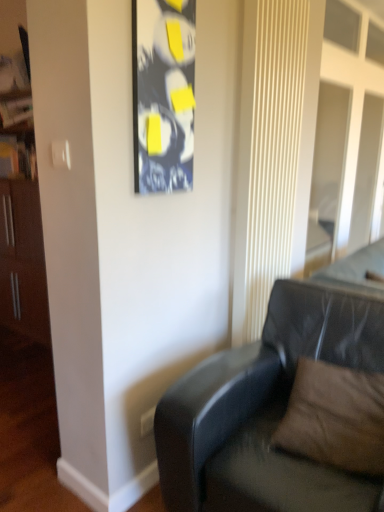
Question: Should I look upward or downward to see brown suede pillow at lower right?

Choices:
 (A) up
 (B) down

Answer: (B)

Question: Is black leather couch at lower right outside of black glossy picture frame at upper center?

Choices:
 (A) yes
 (B) no

Answer: (A)

Question: Is black leather couch at lower right at the left side of black glossy picture frame at upper center?

Choices:
 (A) no
 (B) yes

Answer: (A)

Question: Can you confirm if black leather couch at lower right is shorter than black glossy picture frame at upper center?

Choices:
 (A) no
 (B) yes

Answer: (A)

Question: Does black leather couch at lower right have a smaller size compared to black glossy picture frame at upper center?

Choices:
 (A) no
 (B) yes

Answer: (A)

Question: From the image's perspective, is black leather couch at lower right located above black glossy picture frame at upper center?

Choices:
 (A) yes
 (B) no

Answer: (B)

Question: Is the position of black leather couch at lower right less distant than that of black glossy picture frame at upper center?

Choices:
 (A) no
 (B) yes

Answer: (B)

Question: Does black glossy picture frame at upper center have a smaller size compared to brown suede pillow at lower right?

Choices:
 (A) no
 (B) yes

Answer: (B)

Question: Is black glossy picture frame at upper center in front of brown suede pillow at lower right?

Choices:
 (A) no
 (B) yes

Answer: (A)

Question: Are black glossy picture frame at upper center and brown suede pillow at lower right beside each other?

Choices:
 (A) no
 (B) yes

Answer: (A)

Question: Can you confirm if black glossy picture frame at upper center is bigger than brown suede pillow at lower right?

Choices:
 (A) yes
 (B) no

Answer: (B)

Question: Is black glossy picture frame at upper center wider than brown suede pillow at lower right?

Choices:
 (A) no
 (B) yes

Answer: (A)

Question: Does black glossy picture frame at upper center appear on the left side of brown suede pillow at lower right?

Choices:
 (A) no
 (B) yes

Answer: (B)

Question: Is black glossy picture frame at upper center surrounding black leather couch at lower right?

Choices:
 (A) no
 (B) yes

Answer: (A)